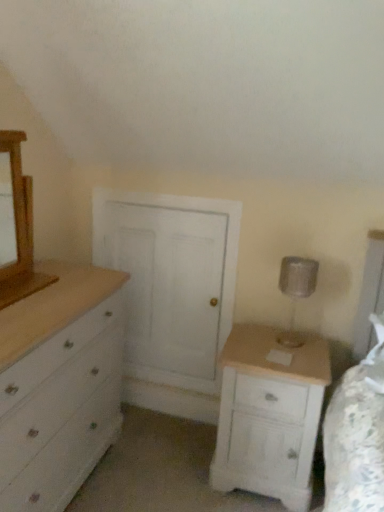
The width and height of the screenshot is (384, 512). Find the location of `free location above white wood nightstand at lower right (from a real-world perspective)`. free location above white wood nightstand at lower right (from a real-world perspective) is located at coordinates (287, 345).